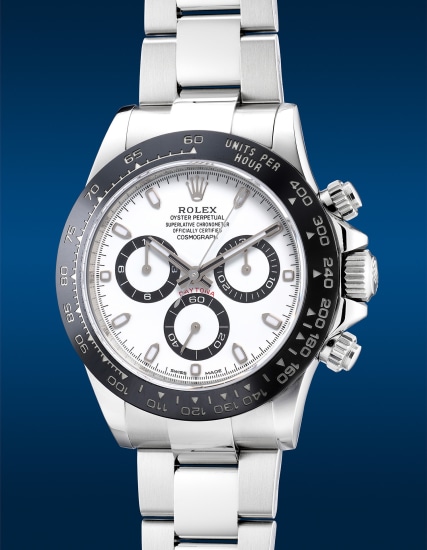
Identify the location of inner clocks. This screenshot has width=427, height=550. (263, 273), (153, 264), (205, 328).